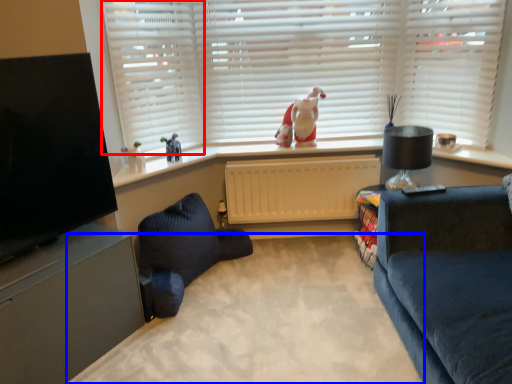
Question: Which point is further to the camera, shutter (highlighted by a red box) or plain (highlighted by a blue box)?

Choices:
 (A) shutter
 (B) plain

Answer: (A)